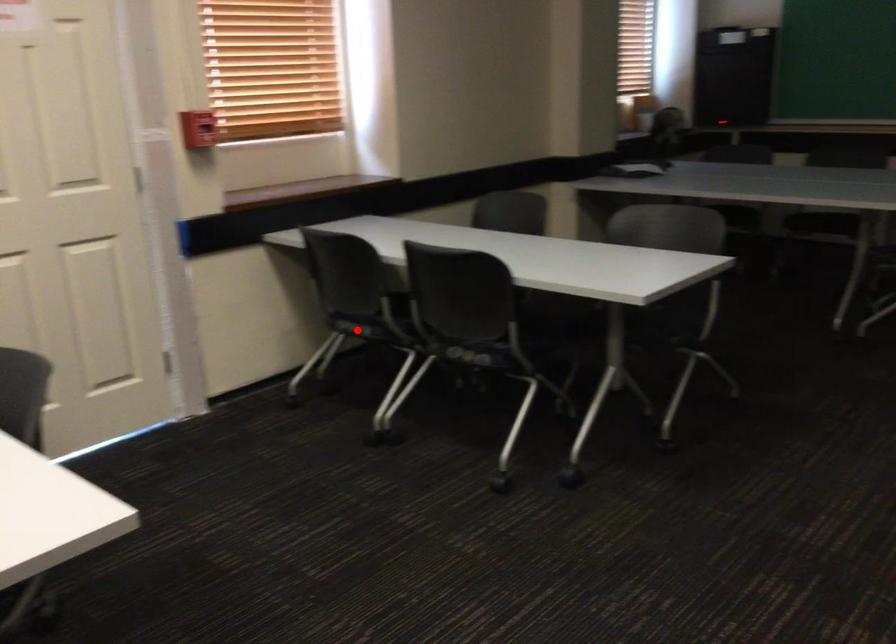
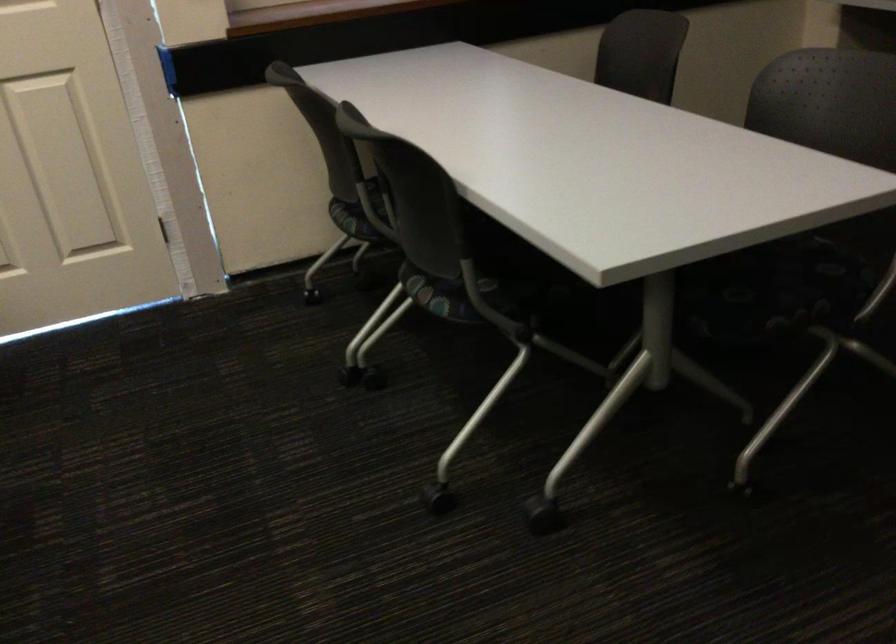
Locate, in the second image, the point that corresponds to the highlighted location in the first image.

(350, 220)